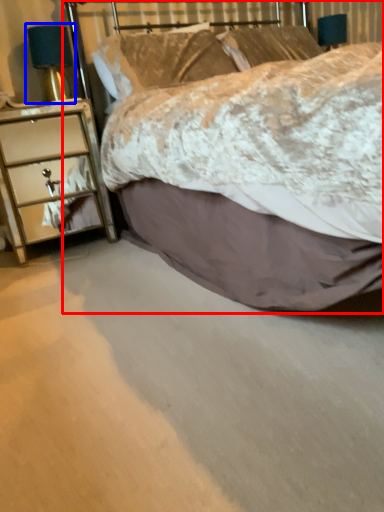
Question: Which point is further to the camera, bed (highlighted by a red box) or bedside lamp (highlighted by a blue box)?

Choices:
 (A) bed
 (B) bedside lamp

Answer: (B)